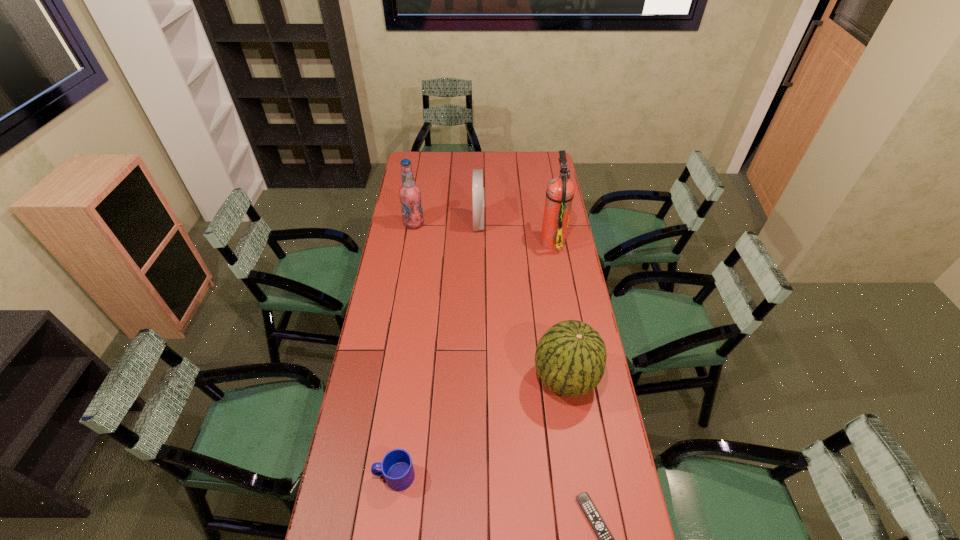
Where is `fire extinguisher`? fire extinguisher is located at coordinates (560, 191).

The image size is (960, 540). In order to click on the fifth shortest object in this screenshot , I will do `click(410, 195)`.

Find the location of a particular element. This screenshot has width=960, height=540. watermelon is located at coordinates (570, 359).

Where is `the third object from left to right`? the third object from left to right is located at coordinates (478, 191).

Locate an element on the screen. the second nearest object is located at coordinates (397, 468).

The width and height of the screenshot is (960, 540). I want to click on the fifth tallest object, so click(x=397, y=468).

The height and width of the screenshot is (540, 960). I want to click on free location located 0.110m at the nozzle of the fire extinguisher, so click(517, 240).

Where is `vacant space positioned at the nozzle of the fire extinguisher`? The height and width of the screenshot is (540, 960). vacant space positioned at the nozzle of the fire extinguisher is located at coordinates (457, 240).

Locate an element on the screen. vacant space located at the nozzle of the fire extinguisher is located at coordinates (521, 240).

The image size is (960, 540). I want to click on vacant space situated 0.180m on the front of the second tallest object, so click(x=409, y=255).